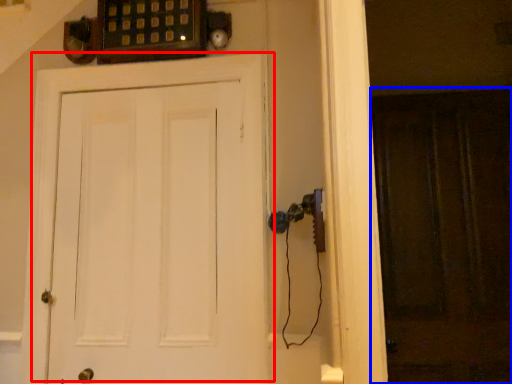
Question: Among these objects, which one is nearest to the camera, door (highlighted by a red box) or screen door (highlighted by a blue box)?

Choices:
 (A) door
 (B) screen door

Answer: (A)